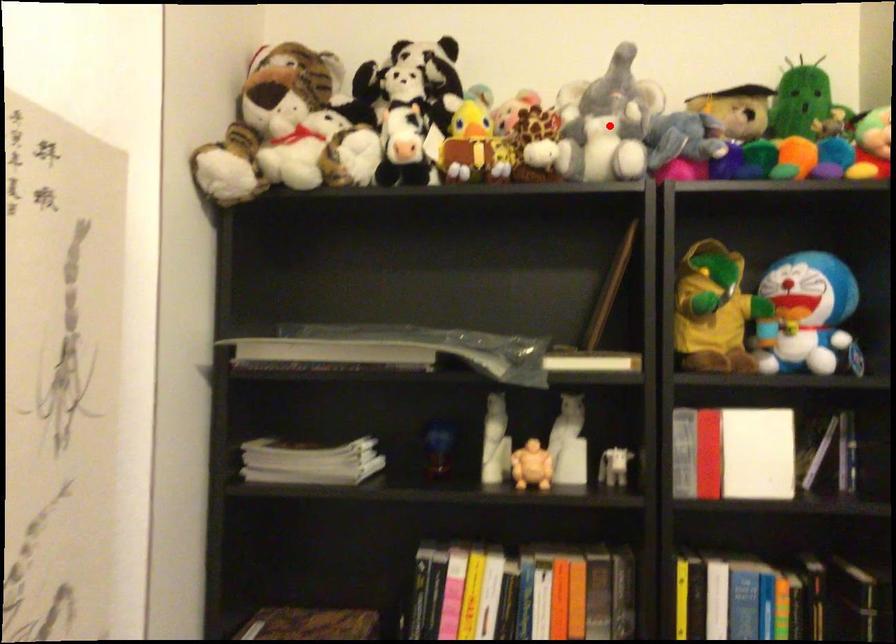
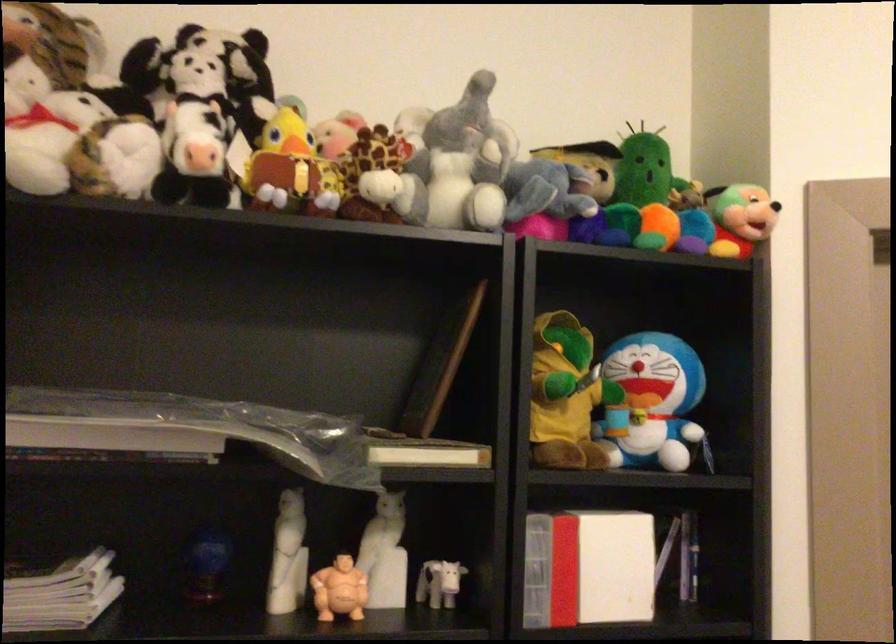
Question: I am providing you with two images of the same scene from different viewpoints. A red point is shown in image1. For the corresponding object point in image2, is it positioned nearer or farther from the camera?

Choices:
 (A) Nearer
 (B) Farther

Answer: (A)